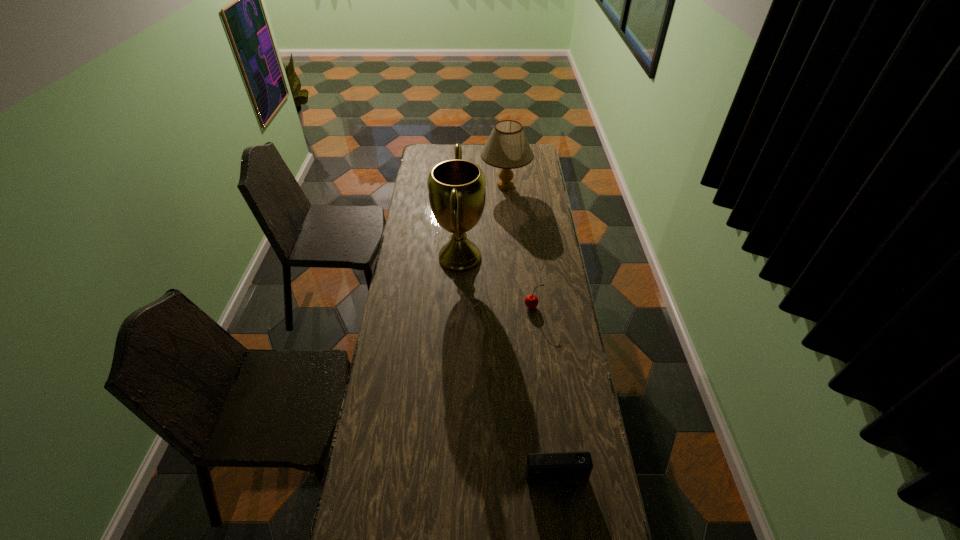
Locate an element on the screen. The height and width of the screenshot is (540, 960). free space between the farthest object and the tallest object is located at coordinates (483, 221).

The width and height of the screenshot is (960, 540). I want to click on vacant space that's between the second tallest object and the nearest object, so click(x=531, y=334).

Point out which object is positioned as the second nearest to the lampshade. Please provide its 2D coordinates. Your answer should be formatted as a tuple, i.e. [(x, y)], where the tuple contains the x and y coordinates of a point satisfying the conditions above.

[(531, 301)]

The height and width of the screenshot is (540, 960). I want to click on object that is the third closest to the farthest object, so click(567, 469).

Where is `free space that satisfies the following two spatial constraints: 1. on the surface of the tallest object with symbols; 2. on the left side of the cherry`? This screenshot has width=960, height=540. free space that satisfies the following two spatial constraints: 1. on the surface of the tallest object with symbols; 2. on the left side of the cherry is located at coordinates (457, 307).

The width and height of the screenshot is (960, 540). Find the location of `vacant space that satisfies the following two spatial constraints: 1. on the back side of the cherry; 2. on the surface of the second farthest object with symbols`. vacant space that satisfies the following two spatial constraints: 1. on the back side of the cherry; 2. on the surface of the second farthest object with symbols is located at coordinates (527, 257).